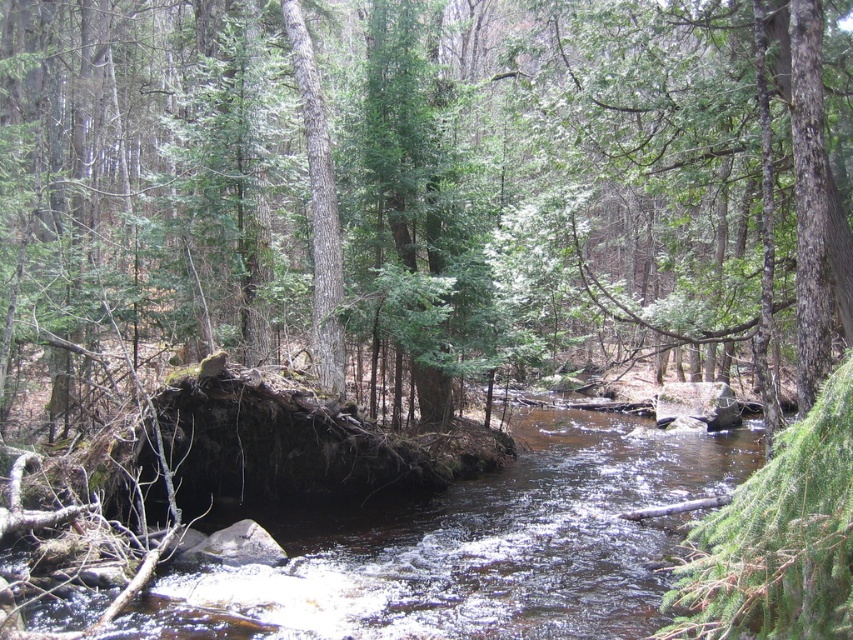
Between brown rough log at center and brown/rocky water at center, which one is positioned lower?

brown/rocky water at center is lower down.

Is point (67, 285) positioned before point (302, 540)?

No, (67, 285) is further to viewer.

Locate an element on the screen. Image resolution: width=853 pixels, height=640 pixels. brown rough log at center is located at coordinates (380, 179).